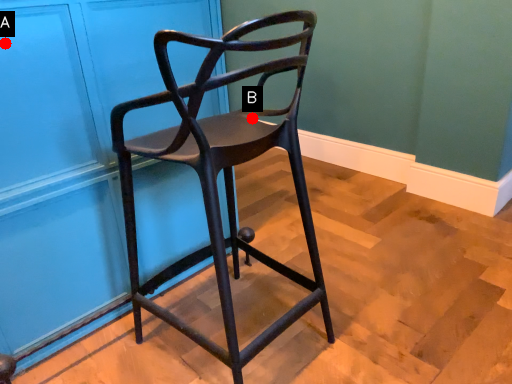
Question: Two points are circled on the image, labeled by A and B beside each circle. Which point appears closest to the camera in this image?

Choices:
 (A) A is closer
 (B) B is closer

Answer: (A)